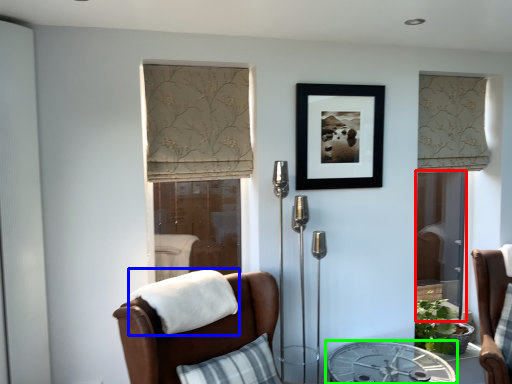
Question: Which is nearer to the screen door (highlighted by a red box)? blanket (highlighted by a blue box) or table (highlighted by a green box).

Choices:
 (A) blanket
 (B) table

Answer: (B)